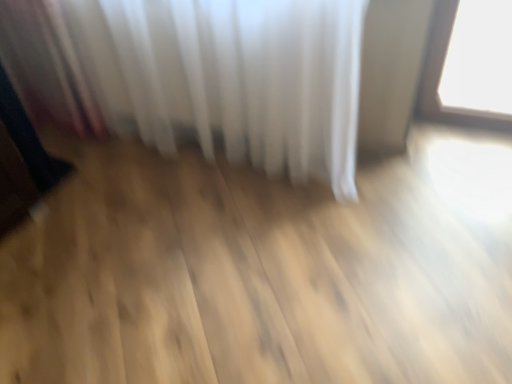
You are a GUI agent. You are given a task and a screenshot of the screen. Output one action in this format:
    pyautogui.click(x=<x>, y=<y>)
    Task: Click on the free location in front of white sheer curtain at upper center
    The width and height of the screenshot is (512, 384).
    Given the screenshot: What is the action you would take?
    pyautogui.click(x=186, y=270)